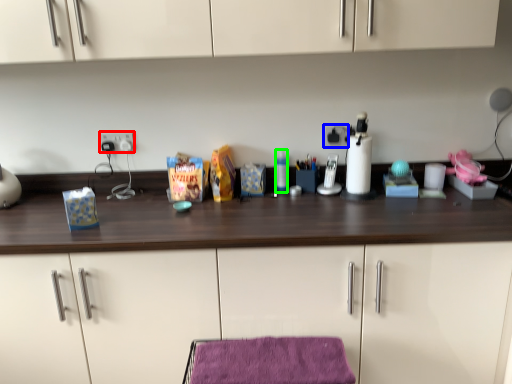
Question: Based on their relative distances, which object is nearer to electric outlet (highlighted by a red box)? Choose from electric outlet (highlighted by a blue box) and bottle (highlighted by a green box).

Choices:
 (A) electric outlet
 (B) bottle

Answer: (B)